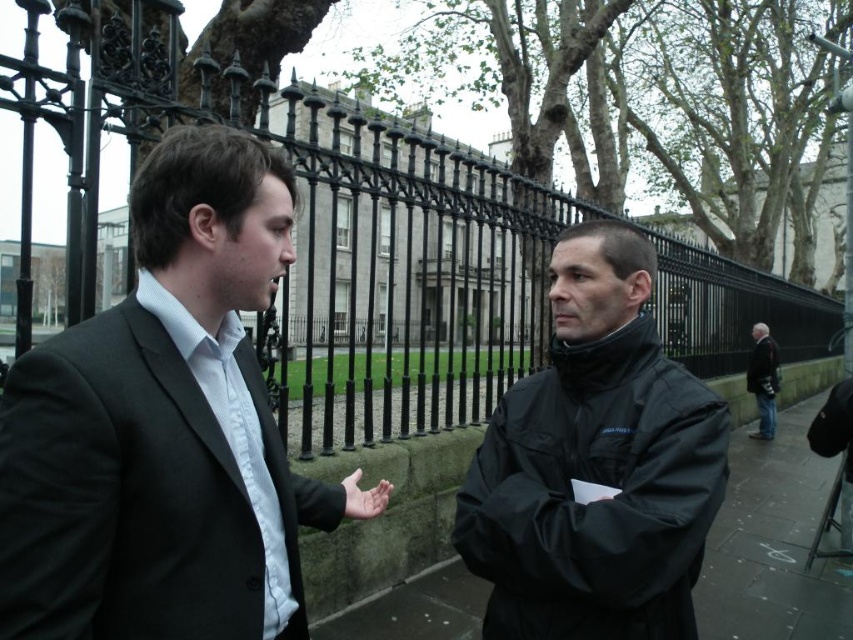
You are a photographer standing in front of the black wrought iron fence. You want to take a photo of both the black matte jacket at center and the black fabric jacket at center. Which jacket will appear larger in the photo?

The black matte jacket at center will appear larger in the photo because it is closer to the viewer than the black fabric jacket at center.

You are a painter standing in the middle of the scene and want to paint the black wrought iron fence at center and the black matte jacket at center. Which object will require a wider brush stroke to capture its full width?

The black wrought iron fence at center requires a wider brush stroke because its width is larger than the black matte jacket at center.